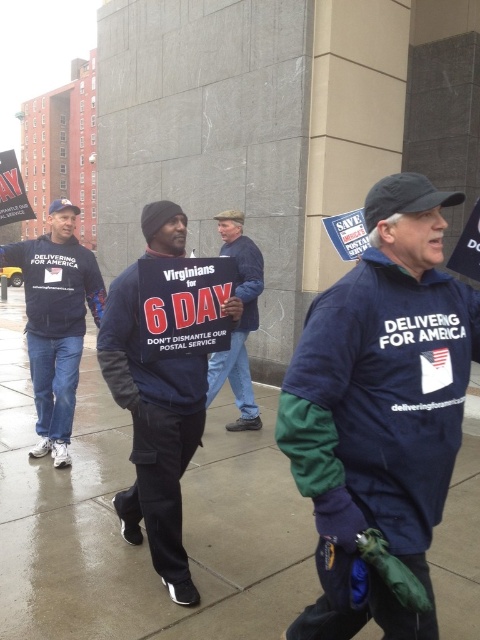
Which is below, wet concrete sidewalk at center or navy blue jacket at center?

wet concrete sidewalk at center is below.

Find the location of a particular element. wet concrete sidewalk at center is located at coordinates (144, 541).

Does matte black jacket at left have a lesser height compared to denim jacket at center?

In fact, matte black jacket at left may be taller than denim jacket at center.

Between point (33, 317) and point (257, 316), which one is positioned in front?

Point (33, 317)

Find the location of a particular element. matte black jacket at left is located at coordinates (56, 321).

Looking at this image, is dark blue sweatshirt at center positioned before matte black jacket at left?

Yes.

Where is `dark blue sweatshirt at center`? The width and height of the screenshot is (480, 640). dark blue sweatshirt at center is located at coordinates (154, 433).

This screenshot has height=640, width=480. In order to click on dark blue sweatshirt at center in this screenshot , I will do `click(154, 433)`.